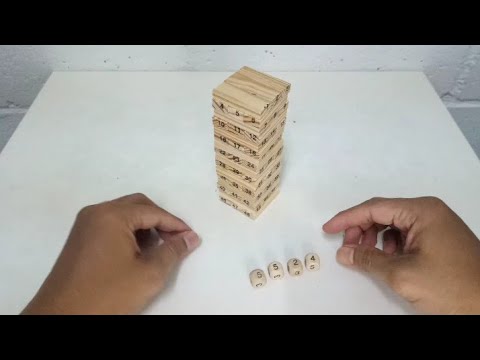
Where is `jenga`? Image resolution: width=480 pixels, height=360 pixels. jenga is located at coordinates (258, 114).